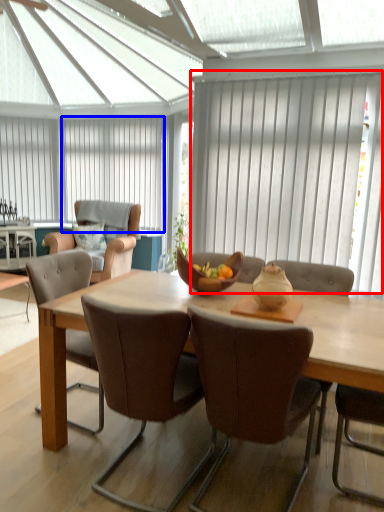
Question: Among these objects, which one is nearest to the camera, curtain (highlighted by a red box) or curtain (highlighted by a blue box)?

Choices:
 (A) curtain
 (B) curtain

Answer: (A)